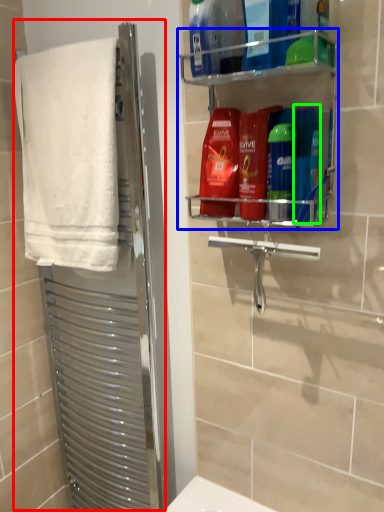
Question: Considering the real-world distances, which object is farthest from screen door (highlighted by a red box)? shelf (highlighted by a blue box) or toiletry (highlighted by a green box)?

Choices:
 (A) shelf
 (B) toiletry

Answer: (B)